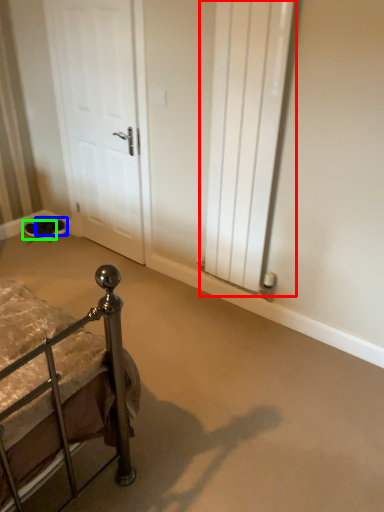
Question: Estimate the real-world distances between objects in this image. Which object is closer to radiator (highlighted by a red box), footwear (highlighted by a blue box) or footwear (highlighted by a green box)?

Choices:
 (A) footwear
 (B) footwear

Answer: (A)